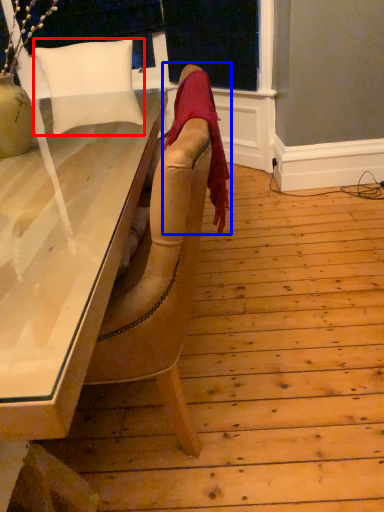
Question: Which of the following is the closest to the observer, pillow (highlighted by a red box) or blanket (highlighted by a blue box)?

Choices:
 (A) pillow
 (B) blanket

Answer: (B)